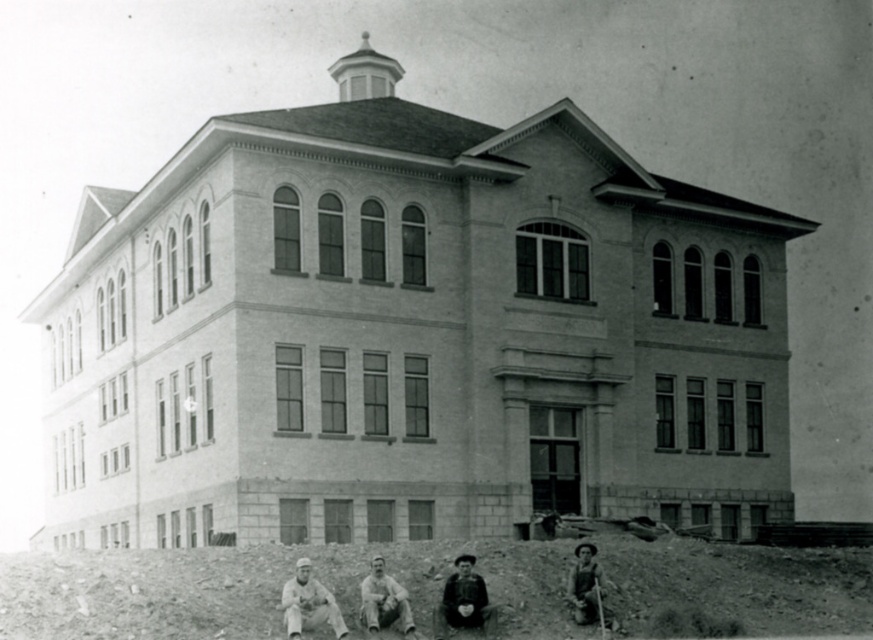
Question: Which of the following is the farthest from the observer?

Choices:
 (A) (600, 602)
 (B) (593, 598)
 (C) (382, 600)
 (D) (492, 612)

Answer: (B)

Question: In this image, where is dark brown leather jacket at lower center located relative to white cloth pants at lower left?

Choices:
 (A) right
 (B) left

Answer: (A)

Question: Which point appears closest to the camera in this image?

Choices:
 (A) (592, 545)
 (B) (301, 560)
 (C) (403, 596)

Answer: (C)

Question: Is the position of white cloth pants at lower left less distant than that of wooden stick at lower right?

Choices:
 (A) yes
 (B) no

Answer: (A)

Question: In this image, where is dark brown leather jacket at lower center located relative to smooth wooden shovel at lower right?

Choices:
 (A) left
 (B) right

Answer: (A)

Question: Among these points, which one is farthest from the camera?

Choices:
 (A) (448, 600)
 (B) (387, 612)
 (C) (571, 586)

Answer: (C)